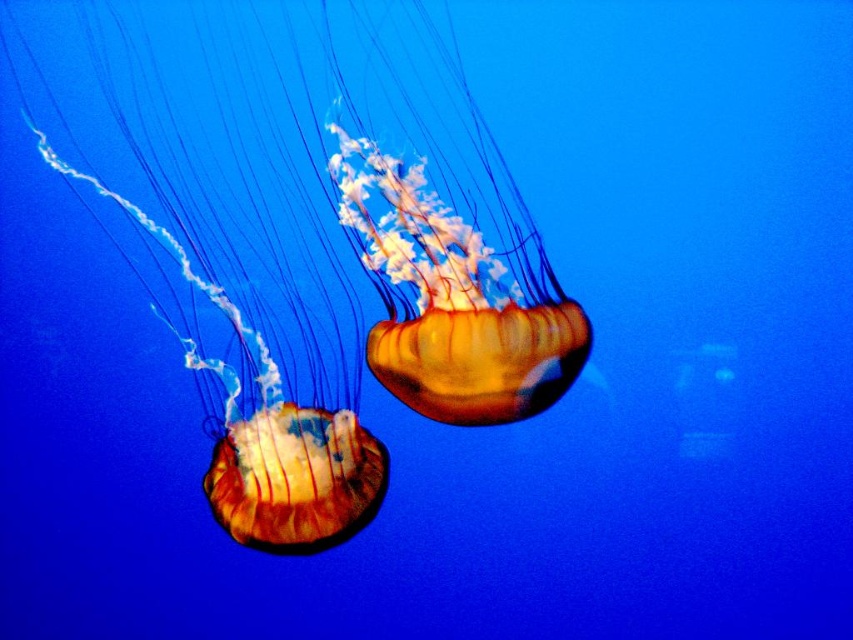
Between translucent orange jellyfish at left and translucent orange jellyfish at center, which one appears on the right side from the viewer's perspective?

Positioned to the right is translucent orange jellyfish at center.

Is point (311, 538) in front of point (369, 163)?

Yes, point (311, 538) is closer to viewer.

Which is behind, point (358, 339) or point (476, 131)?

Positioned behind is point (358, 339).

Find the location of a particular element. The image size is (853, 640). translucent orange jellyfish at left is located at coordinates (213, 260).